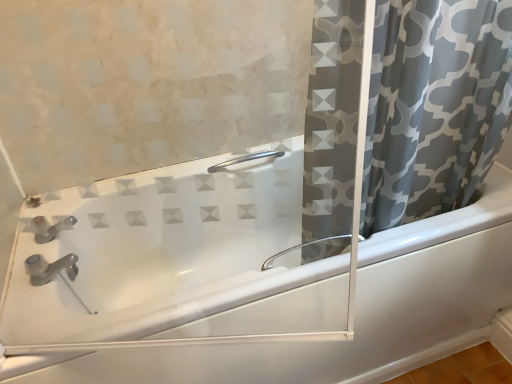
At what (x,y) coordinates should I click in order to perform the action: click on free space to the left of satin nickel faucet at upper left. Please return your answer as a coordinate pair (x, y). This screenshot has height=384, width=512. Looking at the image, I should click on (17, 275).